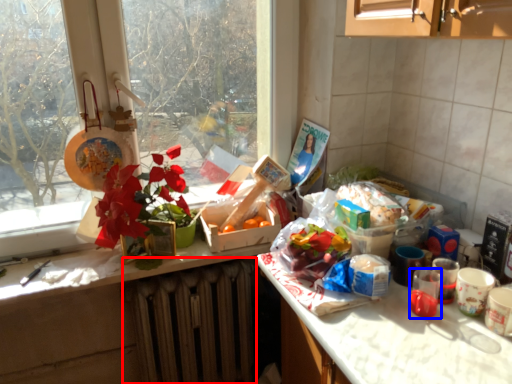
Question: Which object is closer to the camera taking this photo, radiator (highlighted by a red box) or coffee cup (highlighted by a blue box)?

Choices:
 (A) radiator
 (B) coffee cup

Answer: (B)